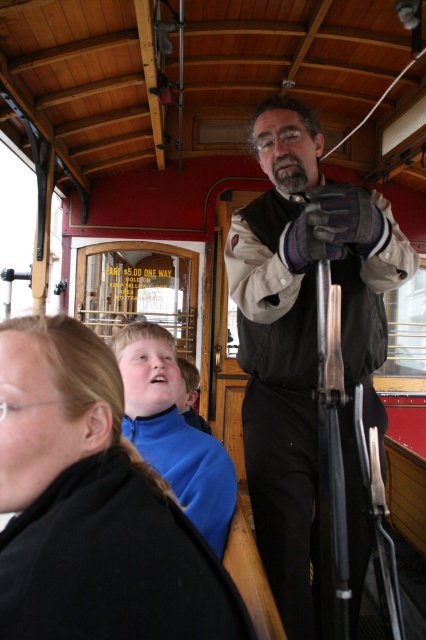
In the scene shown: Between black fabric jacket at lower left and matte black vest at center, which one is positioned lower?

Positioned lower is black fabric jacket at lower left.

Between black fabric jacket at lower left and matte black vest at center, which one has more height?

Standing taller between the two is matte black vest at center.

Measure the distance between black fabric jacket at lower left and camera.

black fabric jacket at lower left and camera are 23.59 inches apart from each other.

Where is `black fabric jacket at lower left`? The height and width of the screenshot is (640, 426). black fabric jacket at lower left is located at coordinates (92, 506).